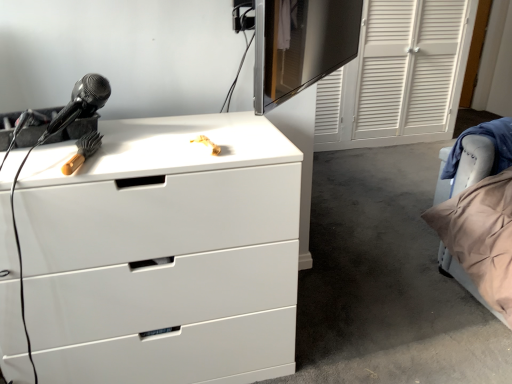
Question: From a real-world perspective, is velvet beige pillow at right below white glossy chest of drawers at upper left?

Choices:
 (A) yes
 (B) no

Answer: (A)

Question: From a real-world perspective, is velvet beige pillow at right located higher than white glossy chest of drawers at upper left?

Choices:
 (A) yes
 (B) no

Answer: (B)

Question: Can you confirm if velvet beige pillow at right is thinner than white glossy chest of drawers at upper left?

Choices:
 (A) yes
 (B) no

Answer: (A)

Question: Can you confirm if velvet beige pillow at right is positioned to the right of white glossy chest of drawers at upper left?

Choices:
 (A) no
 (B) yes

Answer: (B)

Question: Is velvet beige pillow at right directly adjacent to white glossy chest of drawers at upper left?

Choices:
 (A) no
 (B) yes

Answer: (A)

Question: Considering the relative sizes of velvet beige pillow at right and white glossy chest of drawers at upper left in the image provided, is velvet beige pillow at right taller than white glossy chest of drawers at upper left?

Choices:
 (A) no
 (B) yes

Answer: (A)

Question: From the image's perspective, is white glossy chest of drawers at upper left below velvet beige pillow at right?

Choices:
 (A) no
 (B) yes

Answer: (B)

Question: Considering the relative sizes of white glossy chest of drawers at upper left and velvet beige pillow at right in the image provided, is white glossy chest of drawers at upper left taller than velvet beige pillow at right?

Choices:
 (A) no
 (B) yes

Answer: (B)

Question: From the image's perspective, is white glossy chest of drawers at upper left over velvet beige pillow at right?

Choices:
 (A) no
 (B) yes

Answer: (A)

Question: From a real-world perspective, is white glossy chest of drawers at upper left over velvet beige pillow at right?

Choices:
 (A) yes
 (B) no

Answer: (A)

Question: Does white glossy chest of drawers at upper left have a lesser width compared to velvet beige pillow at right?

Choices:
 (A) yes
 (B) no

Answer: (B)

Question: Is white glossy chest of drawers at upper left shorter than velvet beige pillow at right?

Choices:
 (A) yes
 (B) no

Answer: (B)

Question: Can you confirm if black glossy monitor at upper center is positioned to the right of white glossy chest of drawers at upper left?

Choices:
 (A) no
 (B) yes

Answer: (B)